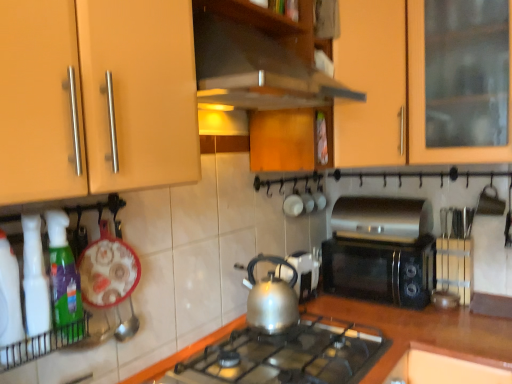
Question: Can you confirm if translucent green spray bottle at left, marked as the 3th kitchen appliance in a back-to-front arrangement, is positioned to the right of wooden exhaust hood at upper center?

Choices:
 (A) no
 (B) yes

Answer: (A)

Question: From a real-world perspective, is translucent green spray bottle at left, which is counted as the first kitchen appliance, starting from the front, over wooden exhaust hood at upper center?

Choices:
 (A) no
 (B) yes

Answer: (A)

Question: From the image's perspective, is translucent green spray bottle at left, which is counted as the first kitchen appliance, starting from the front, above wooden exhaust hood at upper center?

Choices:
 (A) yes
 (B) no

Answer: (B)

Question: Considering the relative sizes of translucent green spray bottle at left, marked as the 3th kitchen appliance in a back-to-front arrangement, and wooden exhaust hood at upper center in the image provided, is translucent green spray bottle at left, marked as the 3th kitchen appliance in a back-to-front arrangement, smaller than wooden exhaust hood at upper center?

Choices:
 (A) no
 (B) yes

Answer: (B)

Question: From the image's perspective, would you say translucent green spray bottle at left, arranged as the 1th kitchen appliance when viewed from the left, is shown under wooden exhaust hood at upper center?

Choices:
 (A) no
 (B) yes

Answer: (B)

Question: Does translucent green spray bottle at left, which is counted as the third kitchen appliance, starting from the right, have a lesser height compared to wooden exhaust hood at upper center?

Choices:
 (A) yes
 (B) no

Answer: (B)

Question: Is the depth of translucent plastic spray bottle at lower left greater than that of wooden exhaust hood at upper center?

Choices:
 (A) yes
 (B) no

Answer: (B)

Question: Is translucent plastic spray bottle at lower left oriented towards wooden exhaust hood at upper center?

Choices:
 (A) no
 (B) yes

Answer: (A)

Question: Is translucent plastic spray bottle at lower left not inside wooden exhaust hood at upper center?

Choices:
 (A) no
 (B) yes

Answer: (B)

Question: Does translucent plastic spray bottle at lower left have a lesser height compared to wooden exhaust hood at upper center?

Choices:
 (A) no
 (B) yes

Answer: (A)

Question: From a real-world perspective, does translucent plastic spray bottle at lower left stand above wooden exhaust hood at upper center?

Choices:
 (A) no
 (B) yes

Answer: (A)

Question: Are translucent plastic spray bottle at lower left and wooden exhaust hood at upper center far apart?

Choices:
 (A) yes
 (B) no

Answer: (B)

Question: Is black plastic microwave at center-right, acting as the third kitchen appliance starting from the front, to the left of translucent plastic spray bottle at lower left from the viewer's perspective?

Choices:
 (A) no
 (B) yes

Answer: (A)